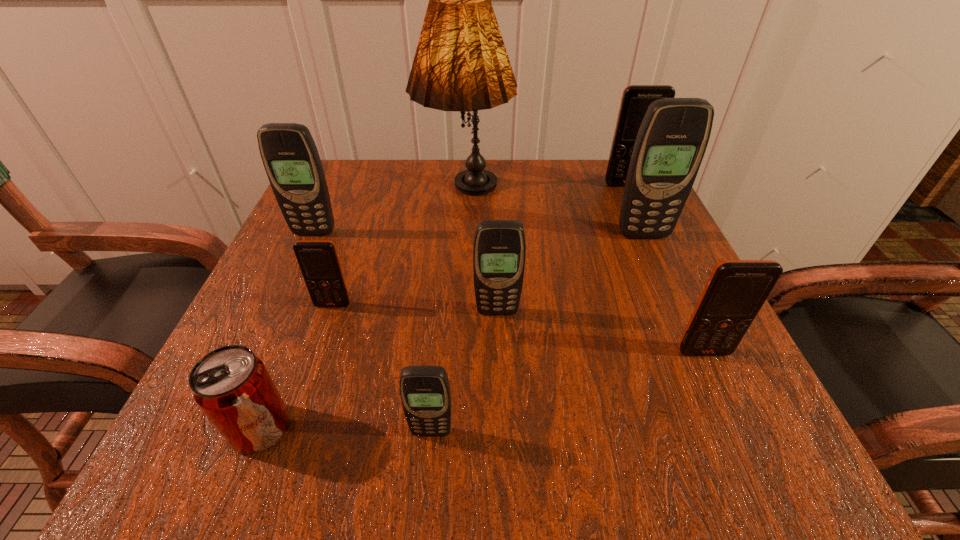
Image resolution: width=960 pixels, height=540 pixels. In order to click on object at the far right corner in this screenshot , I will do `click(636, 99)`.

Locate an element on the screen. This screenshot has height=540, width=960. blank area at the far edge is located at coordinates (516, 166).

You are a GUI agent. You are given a task and a screenshot of the screen. Output one action in this format:
    pyautogui.click(x=<x>, y=<y>)
    Task: Click on the vacant area at the near edge
    The width and height of the screenshot is (960, 540).
    Given the screenshot: What is the action you would take?
    pyautogui.click(x=539, y=451)

In the image, there is a desktop. At what (x,y) coordinates should I click in order to perform the action: click on vacant area at the left edge. Please return your answer as a coordinate pair (x, y). The height and width of the screenshot is (540, 960). Looking at the image, I should click on (345, 275).

You are a GUI agent. You are given a task and a screenshot of the screen. Output one action in this format:
    pyautogui.click(x=<x>, y=<y>)
    Task: Click on the free location at the right edge of the desktop
    Image resolution: width=960 pixels, height=540 pixels.
    Given the screenshot: What is the action you would take?
    pyautogui.click(x=613, y=296)

In order to click on blank space at the far left corner of the desktop in this screenshot , I will do `click(330, 167)`.

Where is `free space at the near left corner of the desktop`? The image size is (960, 540). free space at the near left corner of the desktop is located at coordinates (303, 427).

In the image, there is a desktop. Where is `vacant space at the far right corner`? This screenshot has height=540, width=960. vacant space at the far right corner is located at coordinates (581, 188).

Where is `vacant space that's between the pop soda and the second biggest orange cellular telephone`? vacant space that's between the pop soda and the second biggest orange cellular telephone is located at coordinates (482, 390).

The image size is (960, 540). I want to click on blank region between the second smallest orange cellular telephone and the smallest orange cellular telephone, so click(x=518, y=328).